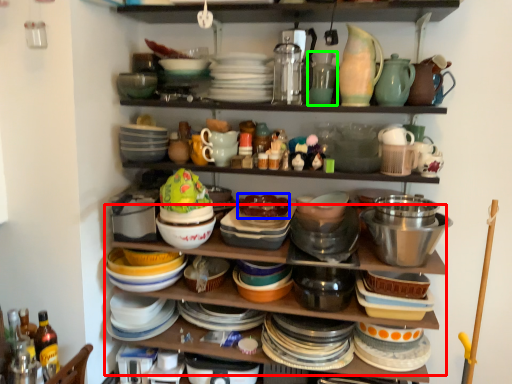
Question: Which object is the closest to the shelf (highlighted by a red box)? Choose among these: food (highlighted by a blue box) or tableware (highlighted by a green box).

Choices:
 (A) food
 (B) tableware

Answer: (A)